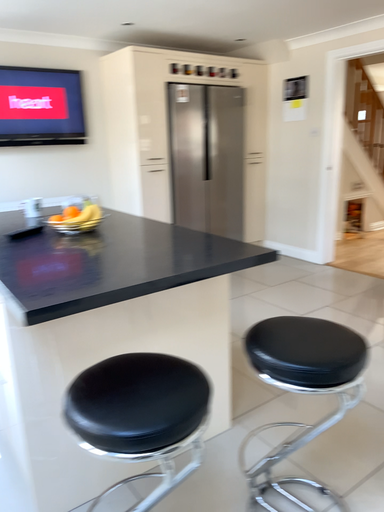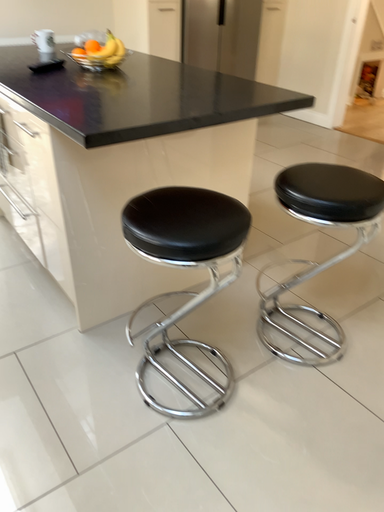
Question: How did the camera likely rotate when shooting the video?

Choices:
 (A) rotated upward
 (B) rotated downward

Answer: (B)